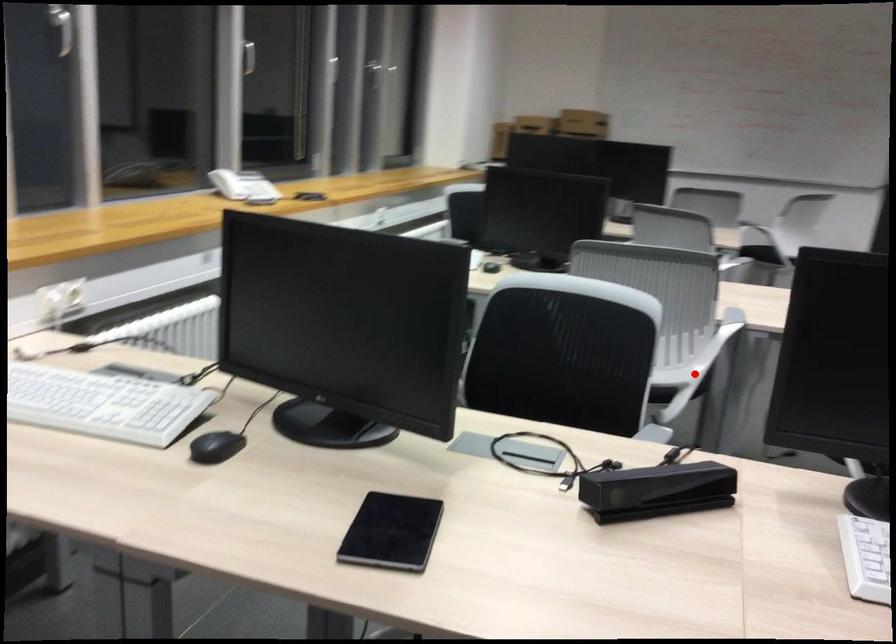
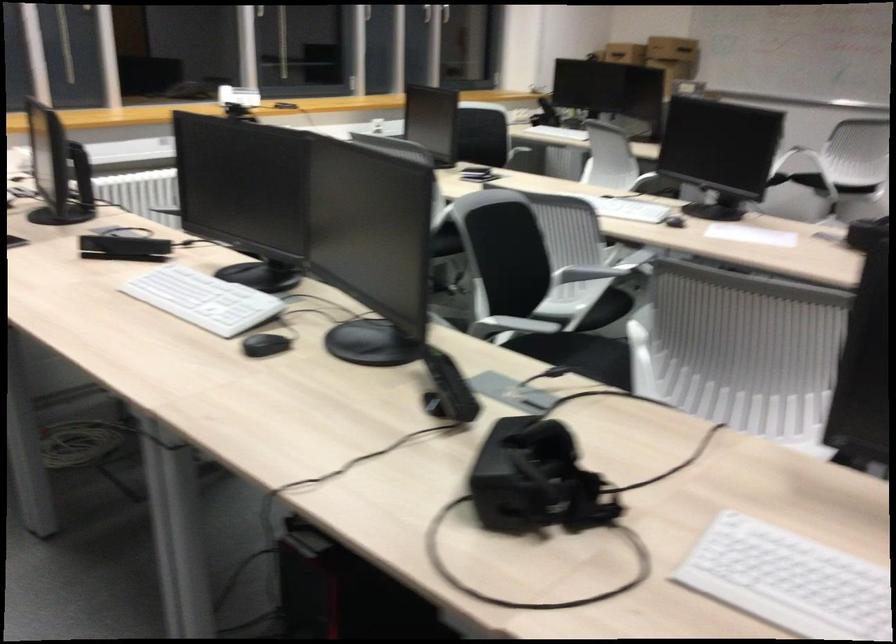
Question: I am providing you with two images of the same scene from different viewpoints. A red point is shown in image1. For the corresponding object point in image2, is it positioned nearer or farther from the camera?

Choices:
 (A) Nearer
 (B) Farther

Answer: (B)